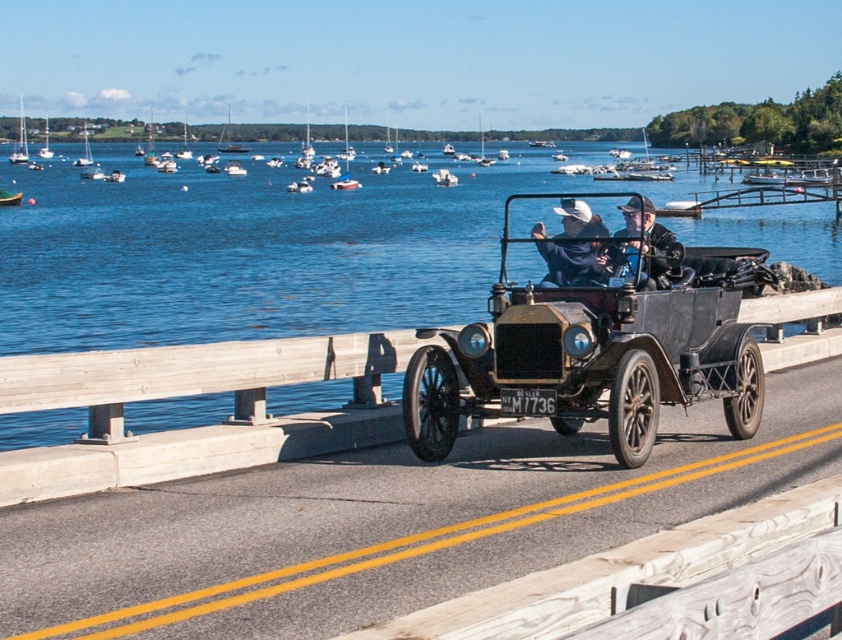
You are a pedestrian standing on the bridge and see the dark blue leather jacket at center and the green fabric boat at left. Which object is closer to the edge of the bridge?

The dark blue leather jacket at center is below the green fabric boat at left, meaning it is closer to the edge of the bridge.

You are standing on the bridge and see the point marked at coordinates (x=594, y=340). What object is located at that point?

The point at coordinates (x=594, y=340) corresponds to the shiny black car at center.

You are a photographer standing next to the white leather cap at center. You want to take a photo of the vintage car driving on the bridge. The camera is 11.00 meters away from the cap. Is the camera positioned on the left or right side of the bridge?

The camera is positioned on the right side of the bridge because the white leather cap at center and camera are 11.00 meters apart, and the bridge has a left side closer to the viewer and the right side further away. Since the photographer is next to the cap, the camera must be on the opposite side of the bridge.